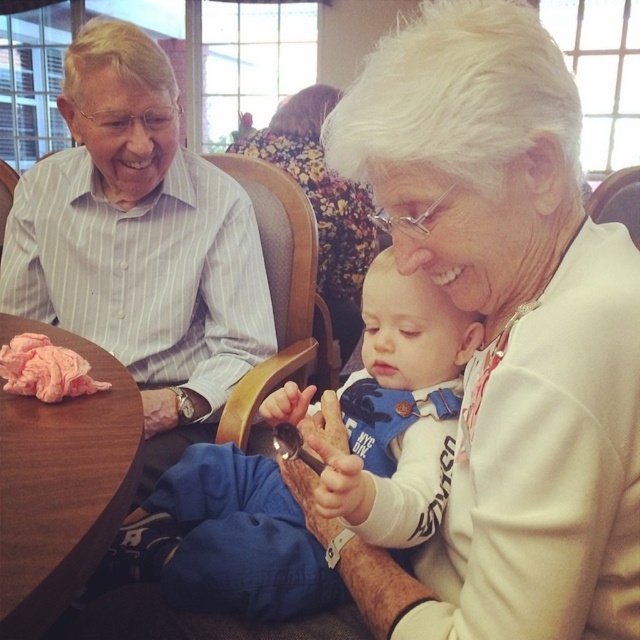
Question: Is wooden table at lower left bigger than white textured hair at upper center?

Choices:
 (A) yes
 (B) no

Answer: (B)

Question: Which object is farther from the camera taking this photo?

Choices:
 (A) pink fabric at table left
 (B) white textured hair at upper center
 (C) white soft baby at center
 (D) wooden table at lower left

Answer: (B)

Question: Which of the following is the closest to the observer?

Choices:
 (A) white textured hair at upper center
 (B) white striped shirt at upper left
 (C) wooden armchair at center

Answer: (B)

Question: Is white striped shirt at upper left wider than wooden armchair at center?

Choices:
 (A) yes
 (B) no

Answer: (A)

Question: Which object is the closest to the pink fabric at table left?

Choices:
 (A) white soft baby at center
 (B) wooden armchair at center
 (C) wooden table at lower left

Answer: (C)

Question: Is white striped shirt at upper left thinner than white textured hair at upper center?

Choices:
 (A) no
 (B) yes

Answer: (A)